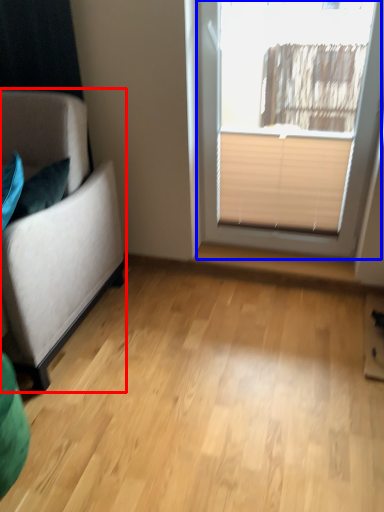
Question: Which object is closer to the camera taking this photo, studio couch (highlighted by a red box) or window (highlighted by a blue box)?

Choices:
 (A) studio couch
 (B) window

Answer: (A)